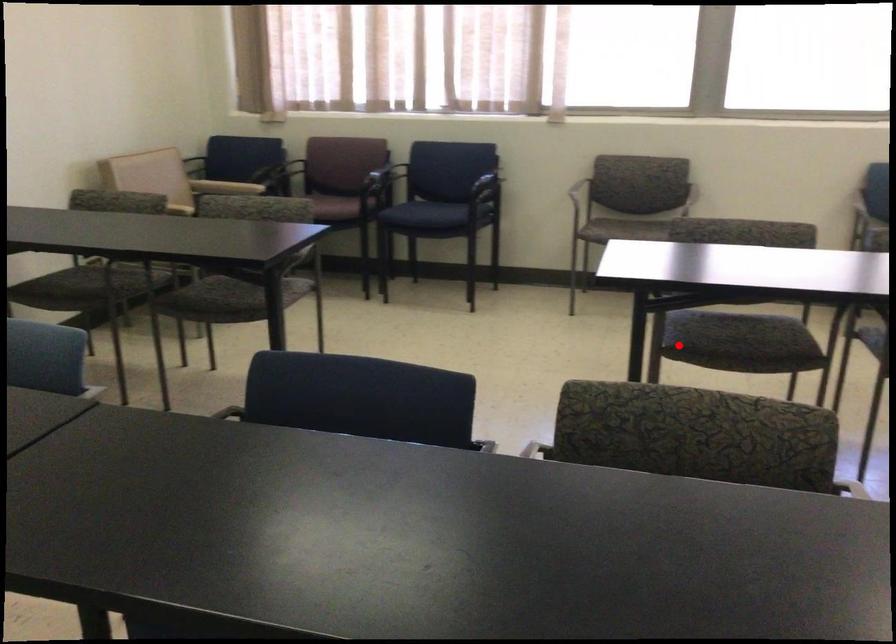
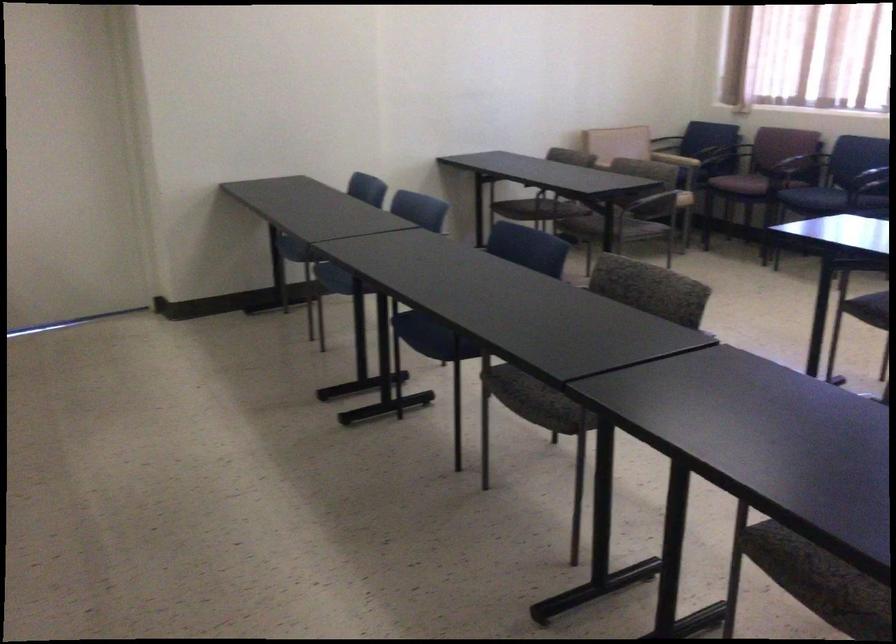
Question: A red point is marked in image1. In image2, is the corresponding 3D point closer to the camera or farther? Reply with the corresponding letter.

Choices:
 (A) The corresponding 3D point is closer.
 (B) The corresponding 3D point is farther.

Answer: (B)